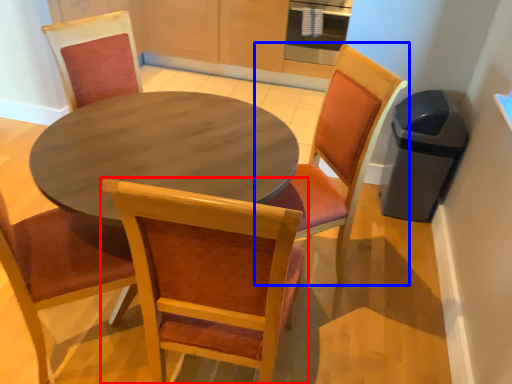
Question: Which object is closer to the camera taking this photo, chair (highlighted by a red box) or chair (highlighted by a blue box)?

Choices:
 (A) chair
 (B) chair

Answer: (A)